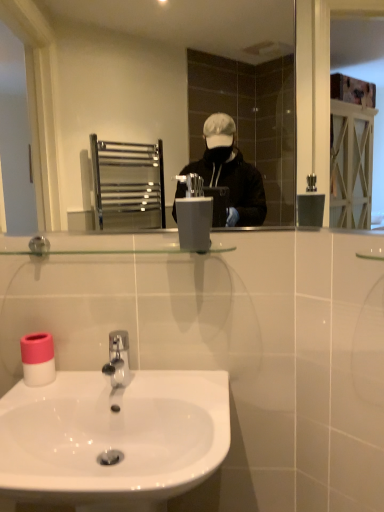
Question: From the image's perspective, is metallic silver mirror at upper center above or below white matte toilet paper at lower left?

Choices:
 (A) below
 (B) above

Answer: (B)

Question: Is metallic silver mirror at upper center wider or thinner than white matte toilet paper at lower left?

Choices:
 (A) thin
 (B) wide

Answer: (A)

Question: Based on their relative distances, which object is nearer to the satin grey plastic at center?

Choices:
 (A) white glossy sink at lower center
 (B) metallic silver mirror at upper center
 (C) white matte toilet paper at lower left

Answer: (A)

Question: Estimate the real-world distances between objects in this image. Which object is closer to the white matte toilet paper at lower left?

Choices:
 (A) metallic silver mirror at upper center
 (B) white glossy sink at lower center
 (C) satin grey plastic at center

Answer: (B)